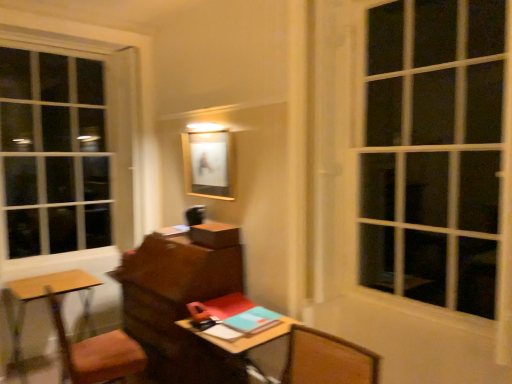
Question: Is white glass window at upper right not within wooden desk at center?

Choices:
 (A) no
 (B) yes

Answer: (B)

Question: Is white glass window at upper right far from wooden desk at center?

Choices:
 (A) yes
 (B) no

Answer: (A)

Question: Considering the relative sizes of white glass window at upper right and wooden desk at center in the image provided, is white glass window at upper right thinner than wooden desk at center?

Choices:
 (A) yes
 (B) no

Answer: (A)

Question: Does white glass window at upper right lie in front of wooden desk at center?

Choices:
 (A) yes
 (B) no

Answer: (A)

Question: From the image's perspective, is white glass window at upper right over wooden desk at center?

Choices:
 (A) yes
 (B) no

Answer: (A)

Question: Could wooden desk at center be considered to be inside white glass window at upper right?

Choices:
 (A) no
 (B) yes

Answer: (A)

Question: From a real-world perspective, is wooden table at lower left on top of wooden desk at center?

Choices:
 (A) yes
 (B) no

Answer: (B)

Question: Is wooden table at lower left to the right of wooden desk at center from the viewer's perspective?

Choices:
 (A) yes
 (B) no

Answer: (B)

Question: Is wooden table at lower left thinner than wooden desk at center?

Choices:
 (A) yes
 (B) no

Answer: (A)

Question: From a real-world perspective, is wooden table at lower left under wooden desk at center?

Choices:
 (A) yes
 (B) no

Answer: (A)

Question: Considering the relative sizes of wooden table at lower left and wooden desk at center in the image provided, is wooden table at lower left shorter than wooden desk at center?

Choices:
 (A) yes
 (B) no

Answer: (B)

Question: Could wooden desk at center be considered to be inside wooden table at lower left?

Choices:
 (A) yes
 (B) no

Answer: (B)

Question: From the image's perspective, does wooden table at lower left appear higher than teal matte notebook at center?

Choices:
 (A) yes
 (B) no

Answer: (B)